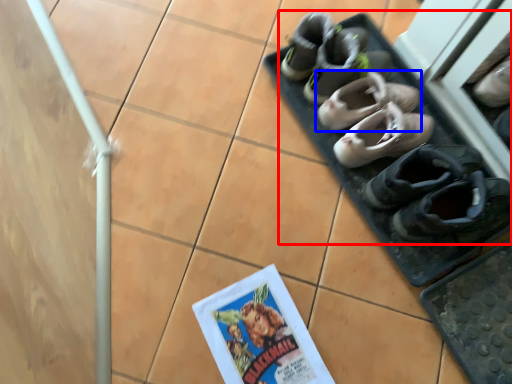
Question: Which object appears closest to the camera in this image, footwear (highlighted by a red box) or footwear (highlighted by a blue box)?

Choices:
 (A) footwear
 (B) footwear

Answer: (A)